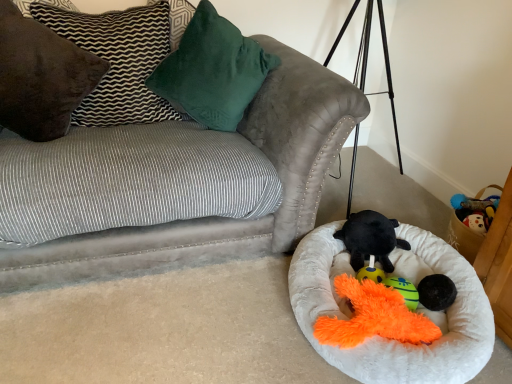
Question: Is velvet gray couch at upper left spatially inside brown suede pillow at upper left, which is counted as the second pillow, starting from the left, or outside of it?

Choices:
 (A) inside
 (B) outside

Answer: (B)

Question: Considering the positions of velvet gray couch at upper left and brown suede pillow at upper left, which is counted as the second pillow, starting from the left, in the image, is velvet gray couch at upper left wider or thinner than brown suede pillow at upper left, which is counted as the second pillow, starting from the left,?

Choices:
 (A) thin
 (B) wide

Answer: (B)

Question: Which is farther from the velvet gray couch at upper left?

Choices:
 (A) velvety green pillow at upper center, acting as the 3th pillow starting from the left
 (B) orange plush toy at lower center
 (C) brown velvet pillow at upper left, acting as the 1th pillow starting from the left
 (D) white fluffy dog bed at lower right
 (E) black plush toy at center, which ranks as the first toy in back-to-front order

Answer: (B)

Question: Considering the real-world distances, which object is farthest from the brown velvet pillow at upper left, the third pillow viewed from the right?

Choices:
 (A) brown suede pillow at upper left, which appears as the second pillow when viewed from the right
 (B) orange plush toy at lower center
 (C) velvet gray couch at upper left
 (D) velvety green pillow at upper center, which ranks as the 1th pillow in right-to-left order
 (E) teal plush toy at lower center

Answer: (E)